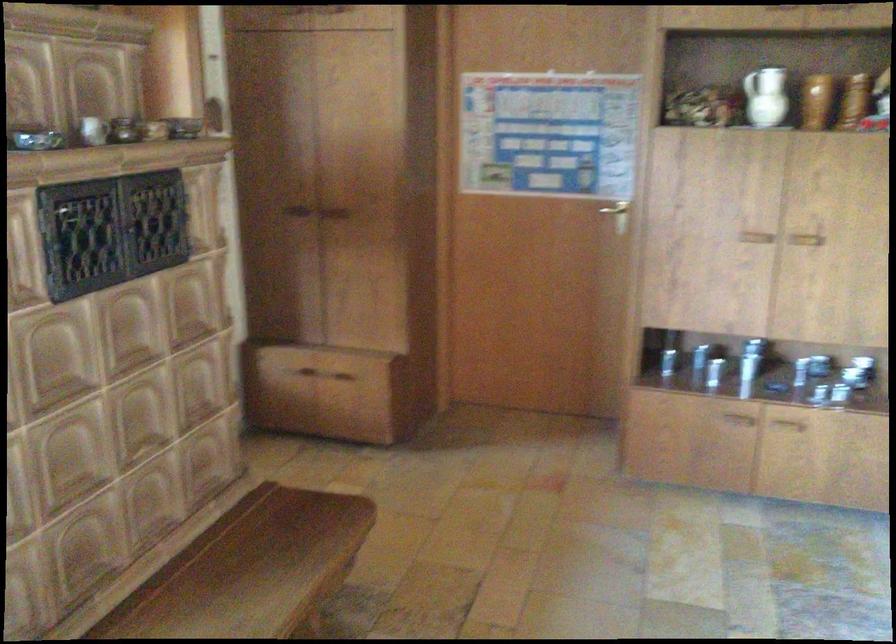
Image resolution: width=896 pixels, height=644 pixels. I want to click on wooden bench surface, so click(257, 569).